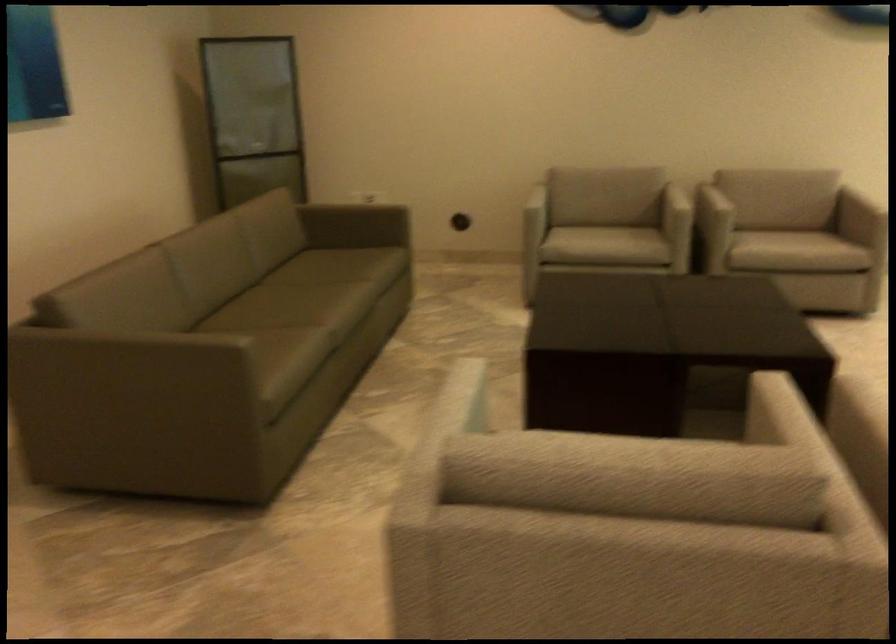
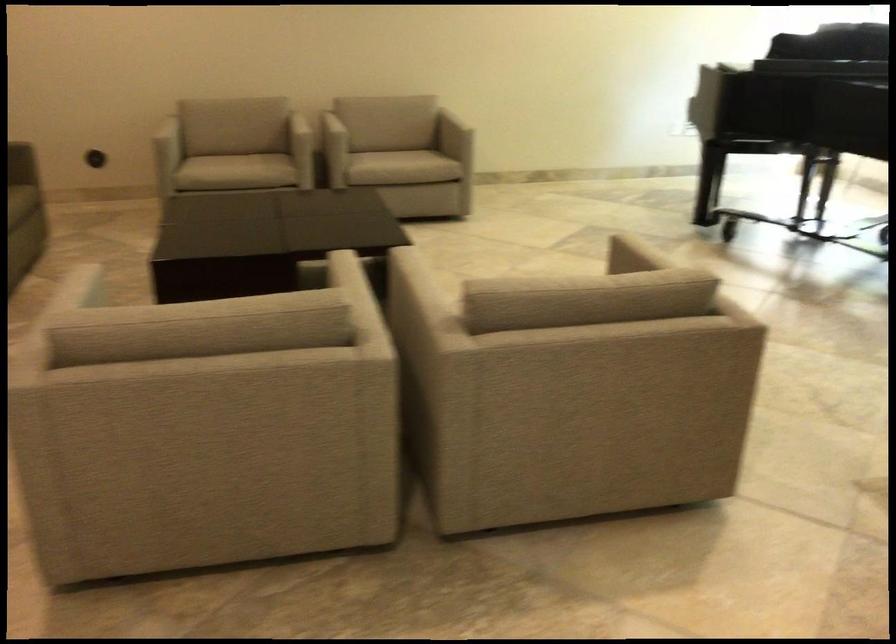
In a continuous first-person perspective shot, in which direction is the camera moving?

The cameraman walked toward right, backward.